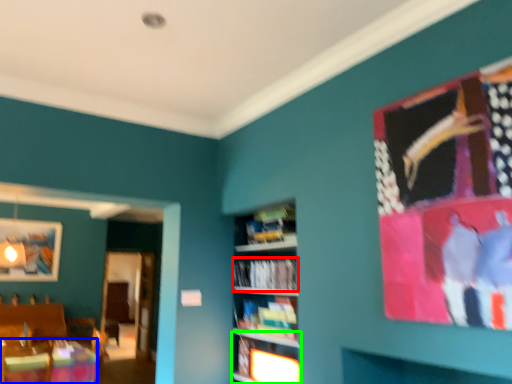
Question: Which object is positioned closest to book (highlighted by a red box)? Select from table (highlighted by a blue box) and shelf (highlighted by a green box).

Choices:
 (A) table
 (B) shelf

Answer: (B)